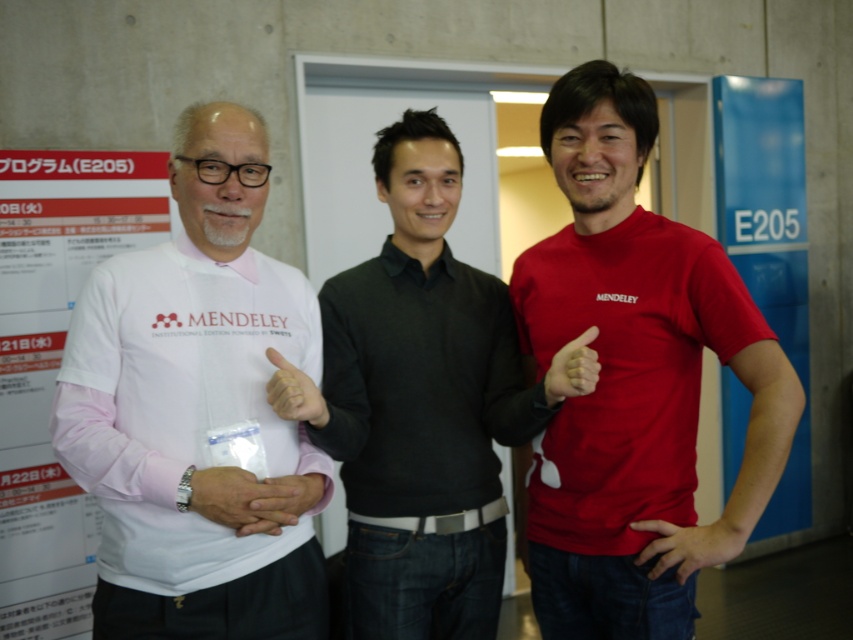
Question: Is matte white hand at center bigger than matte black thumb at center?

Choices:
 (A) no
 (B) yes

Answer: (B)

Question: Is matte red shirt at center positioned behind matte white hand at center?

Choices:
 (A) yes
 (B) no

Answer: (A)

Question: Which point is closer to the camera?

Choices:
 (A) white matte watch at center
 (B) dark gray sweater at center
 (C) matte white hand at center
 (D) white matte shirt at left

Answer: (D)

Question: Which is farther from the white matte hand at center?

Choices:
 (A) white matte watch at center
 (B) blue paper at right
 (C) matte black thumb at center

Answer: (B)

Question: Which point is closer to the camera taking this photo?

Choices:
 (A) (292, 400)
 (B) (741, 285)

Answer: (A)

Question: Is white paper at left closer to the viewer compared to white matte watch at center?

Choices:
 (A) yes
 (B) no

Answer: (B)